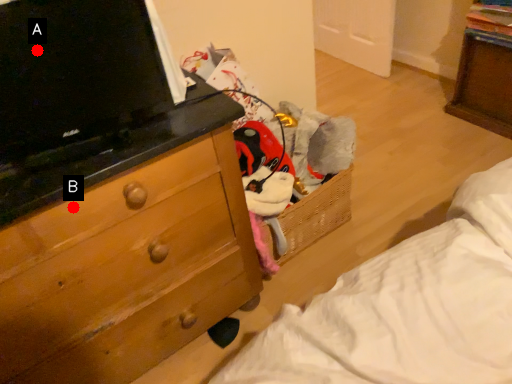
Question: Two points are circled on the image, labeled by A and B beside each circle. Which of the following is the farthest from the observer?

Choices:
 (A) A is further
 (B) B is further

Answer: (B)